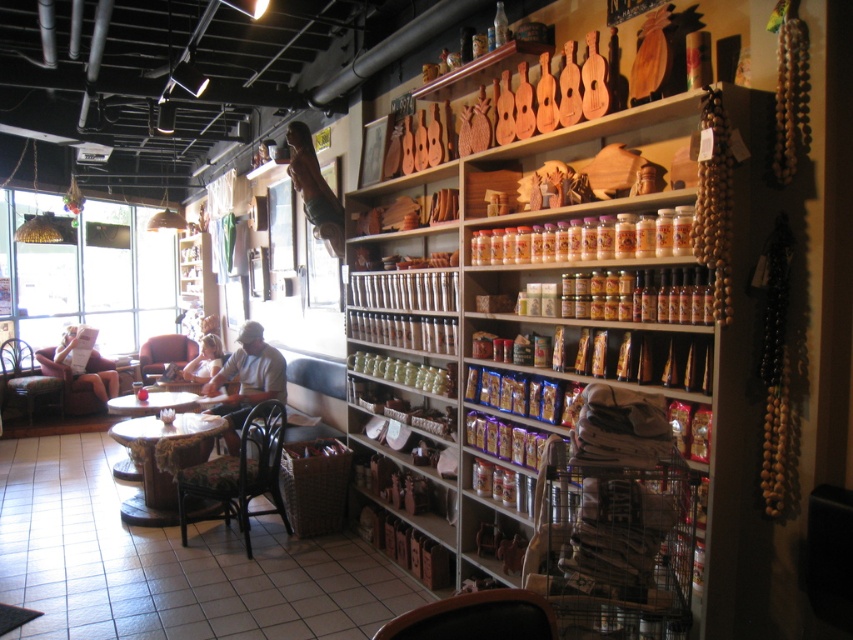
Is wooden carved objects at right to the left of wooden chair at left from the viewer's perspective?

No, wooden carved objects at right is not to the left of wooden chair at left.

Looking at this image, is wooden carved objects at right bigger than wooden chair at left?

Indeed, wooden carved objects at right has a larger size compared to wooden chair at left.

What are the coordinates of `wooden carved objects at right` in the screenshot? It's located at (550, 378).

Can you confirm if wooden carved objects at right is bigger than white fabric person at center?

Correct, wooden carved objects at right is larger in size than white fabric person at center.

Can you confirm if wooden carved objects at right is taller than white fabric person at center?

Correct, wooden carved objects at right is much taller as white fabric person at center.

Between point (488, 330) and point (212, 362), which one is positioned behind?

Point (212, 362)

Where is `wooden carved objects at right`? The image size is (853, 640). wooden carved objects at right is located at coordinates (550, 378).

Does velvet-like pink armchair at center-left appear under wooden table at lower left?

Incorrect, velvet-like pink armchair at center-left is not positioned below wooden table at lower left.

Does velvet-like pink armchair at center-left have a greater height compared to wooden table at lower left?

Indeed, velvet-like pink armchair at center-left has a greater height compared to wooden table at lower left.

Who is more forward, (x=143, y=358) or (x=144, y=388)?

Point (x=144, y=388)

Identify the location of velvet-like pink armchair at center-left. (164, 355).